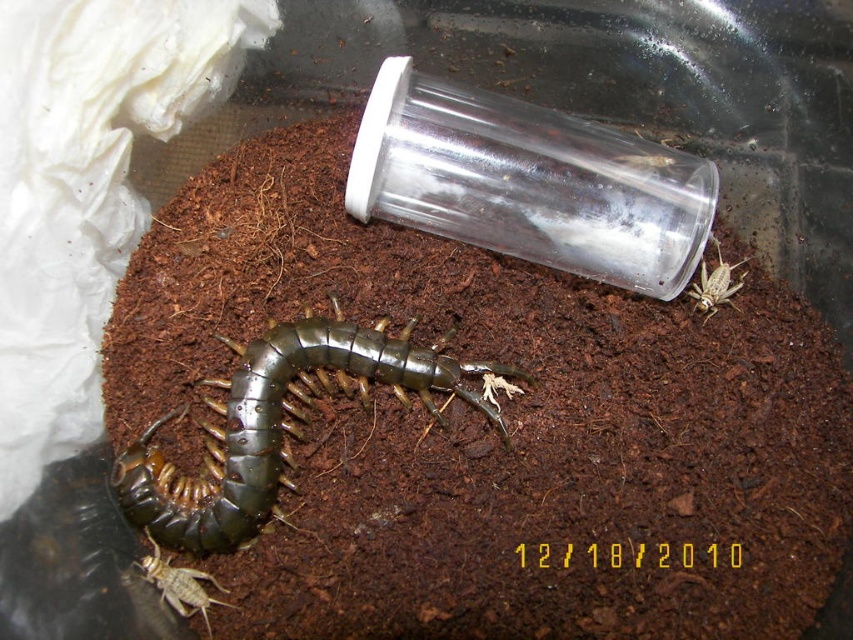
How distant is shiny metallic centipede at center from translucent brown cricket at lower left?

The distance of shiny metallic centipede at center from translucent brown cricket at lower left is 9.05 inches.

From the picture: Who is higher up, shiny metallic centipede at center or translucent brown cricket at lower left?

shiny metallic centipede at center is above.

Image resolution: width=853 pixels, height=640 pixels. What are the coordinates of `shiny metallic centipede at center` in the screenshot? It's located at (277, 424).

From the picture: Can you confirm if shiny metallic centipede at center is taller than brown textured cricket at right?

Indeed, shiny metallic centipede at center has a greater height compared to brown textured cricket at right.

Does shiny metallic centipede at center appear on the left side of brown textured cricket at right?

Correct, you'll find shiny metallic centipede at center to the left of brown textured cricket at right.

What do you see at coordinates (277, 424) in the screenshot?
I see `shiny metallic centipede at center` at bounding box center [277, 424].

This screenshot has width=853, height=640. Identify the location of shiny metallic centipede at center. (277, 424).

Is brown soil at center positioned behind translucent brown cricket at lower left?

Yes, it is behind translucent brown cricket at lower left.

Is point (343, 460) positioned in front of point (235, 608)?

No.

Who is more distant from viewer, (315, 124) or (169, 595)?

The point (315, 124) is behind.

You are a GUI agent. You are given a task and a screenshot of the screen. Output one action in this format:
    pyautogui.click(x=<x>, y=<y>)
    Task: Click on the brown soil at center
    
    Given the screenshot: What is the action you would take?
    pyautogui.click(x=492, y=429)